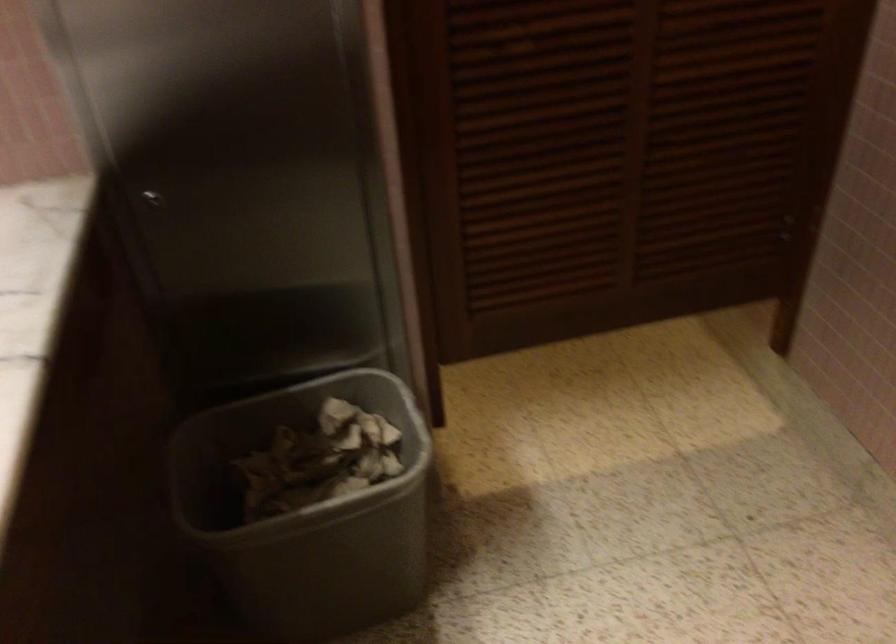
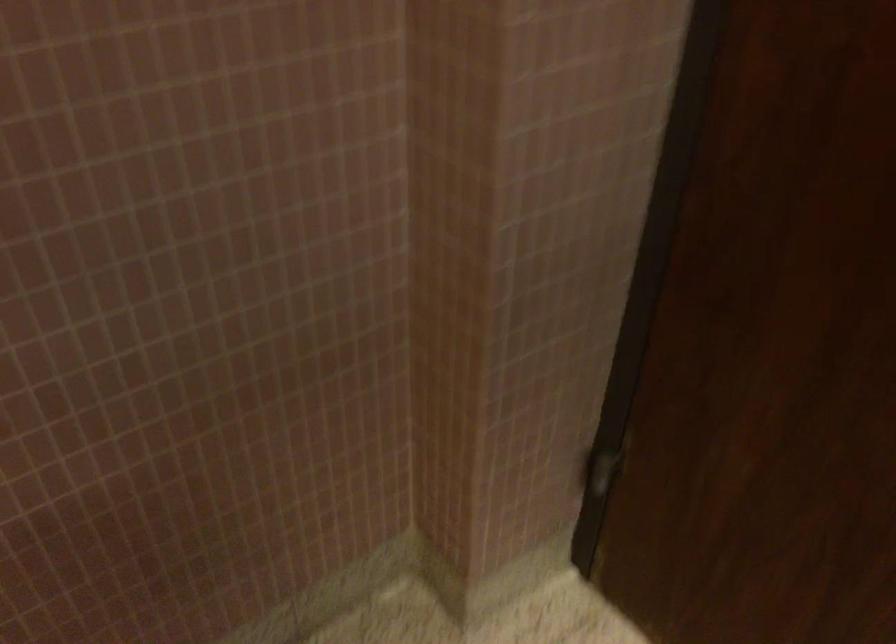
First-person continuous shooting, in which direction is the camera rotating?

The camera rotated toward right-down.